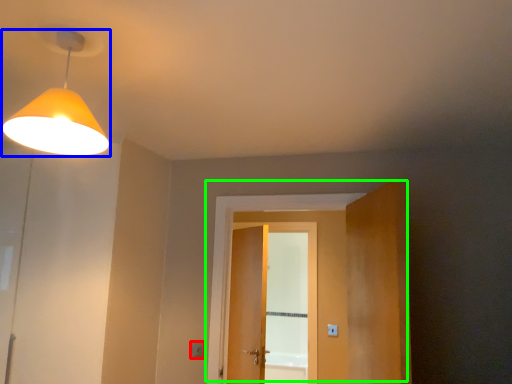
Question: Which object is positioned farthest from light switch (highlighted by a red box)? Select from lamp (highlighted by a blue box) and door (highlighted by a green box).

Choices:
 (A) lamp
 (B) door

Answer: (A)